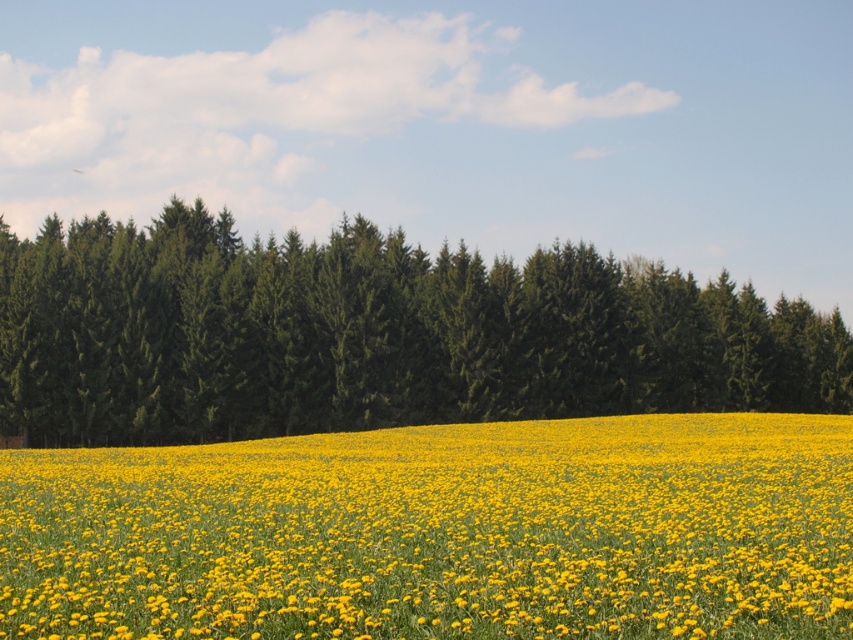
Question: Which point is closer to the camera?

Choices:
 (A) (390, 412)
 (B) (795, 579)

Answer: (B)

Question: Is yellow matte flower at center below green matte trees at center?

Choices:
 (A) yes
 (B) no

Answer: (A)

Question: Where is yellow matte flower at center located in relation to green matte trees at center in the image?

Choices:
 (A) left
 (B) right

Answer: (A)

Question: Can you confirm if yellow matte flower at center is thinner than green matte trees at center?

Choices:
 (A) no
 (B) yes

Answer: (B)